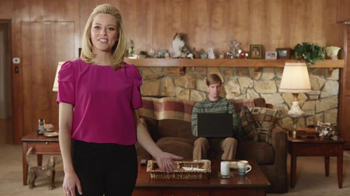
Find the location of a particular element. The width and height of the screenshot is (350, 196). stone fire place is located at coordinates (255, 80).